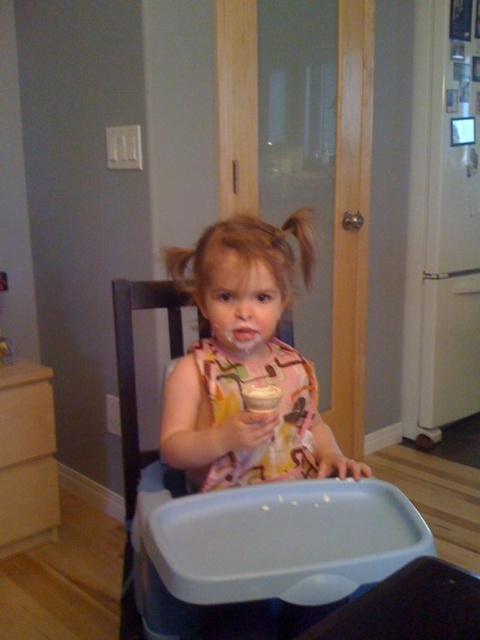
The child is sitting in a high chair with a clean tray. You notice two items at the center of the scene. Which item is positioned higher on the tray between the matte pink dress at center and the white matte cup at center?

The matte pink dress at center is located above the white matte cup at center on the tray.

The child in the high chair has a printed fabric bib at center and a white matte cup at center. Which object is closer to the child?

The printed fabric bib at center is closer to the child because it is further to the viewer than the white matte cup at center.

You are taking a photo of the child in the high chair. You notice two points in the image at coordinates point (x=206, y=371) and point (x=280, y=420). Which point will appear larger in your photo?

Point (x=206, y=371) is closer to the camera than point (x=280, y=420), so it will appear larger in the photo.